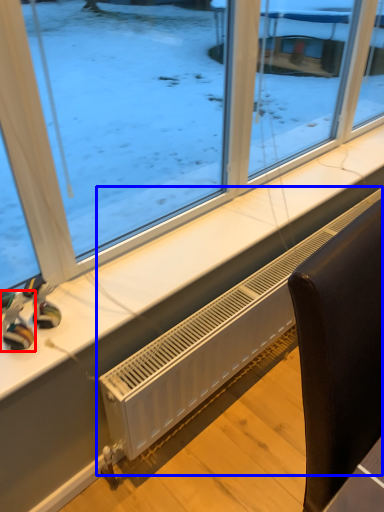
Question: Which object appears closest to the camera in this image, toy (highlighted by a red box) or air conditioning (highlighted by a blue box)?

Choices:
 (A) toy
 (B) air conditioning

Answer: (A)